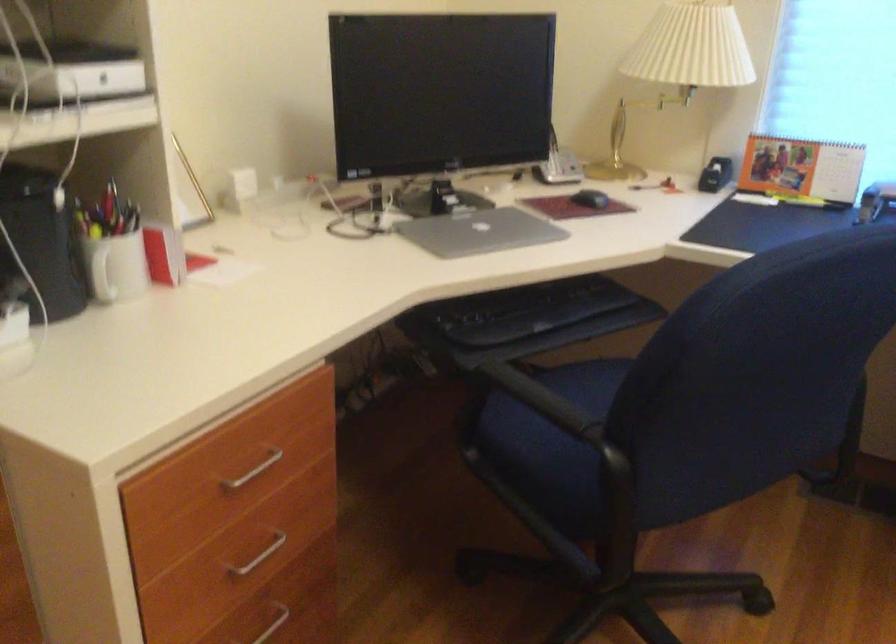
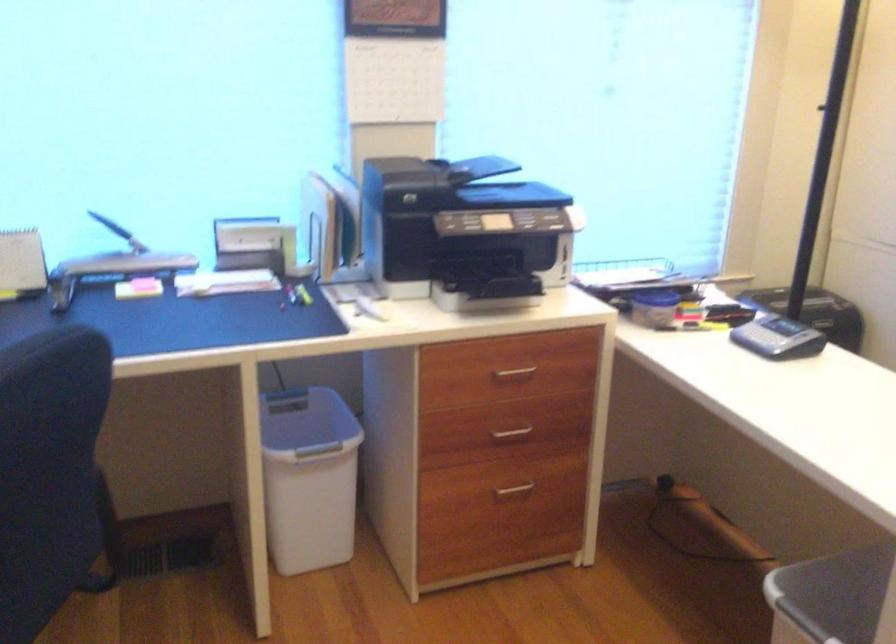
Where in the second image is the point corresponding to point (807, 343) from the first image?

(48, 471)